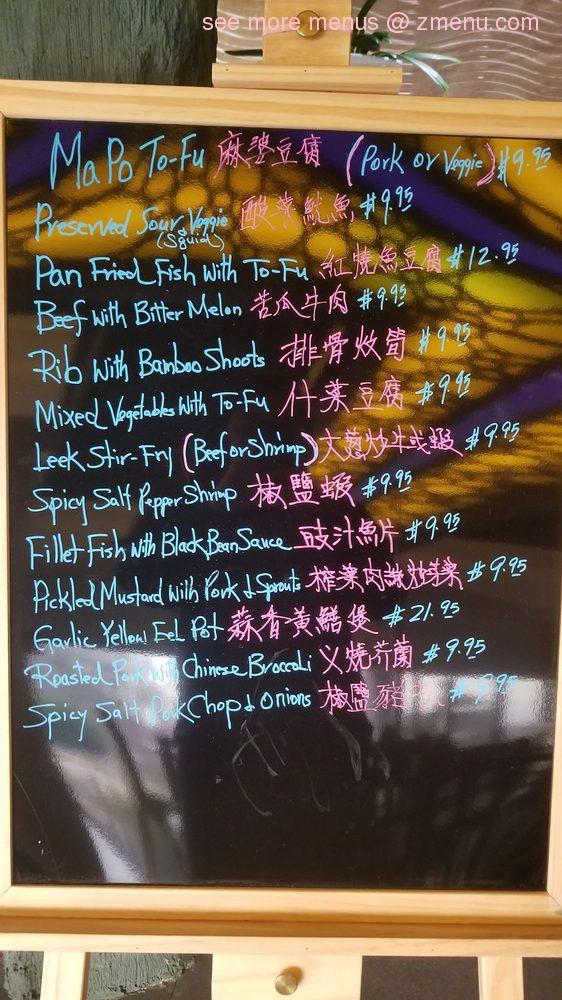
What are the coordinates of `reflection on menu board` in the screenshot? It's located at (99, 755).